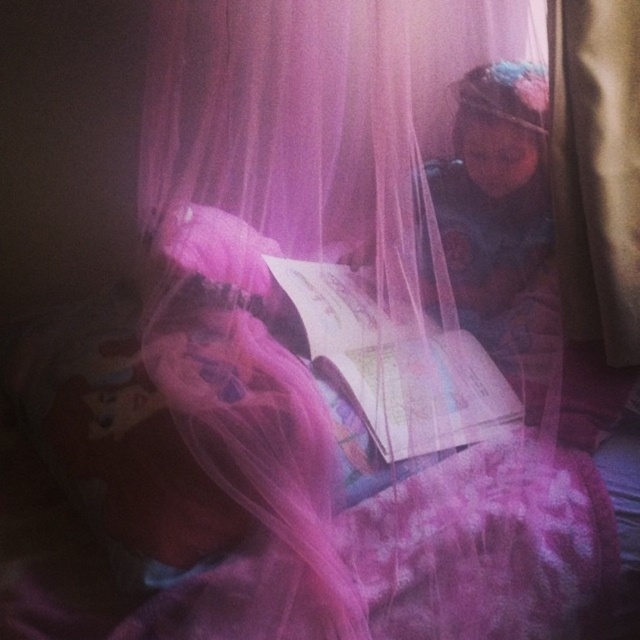
Question: Which point appears farthest from the camera in this image?

Choices:
 (A) (577, 45)
 (B) (394, 429)

Answer: (A)

Question: Among these points, which one is farthest from the camera?

Choices:
 (A) (493, 401)
 (B) (564, 19)

Answer: (A)

Question: Which of the following is the farthest from the observer?

Choices:
 (A) (625, 3)
 (B) (460, 378)

Answer: (B)

Question: Is brown fabric curtain at right bigger than matte paper book at center?

Choices:
 (A) no
 (B) yes

Answer: (A)

Question: Does brown fabric curtain at right come in front of matte paper book at center?

Choices:
 (A) yes
 (B) no

Answer: (B)

Question: Can you confirm if brown fabric curtain at right is positioned above matte paper book at center?

Choices:
 (A) yes
 (B) no

Answer: (A)